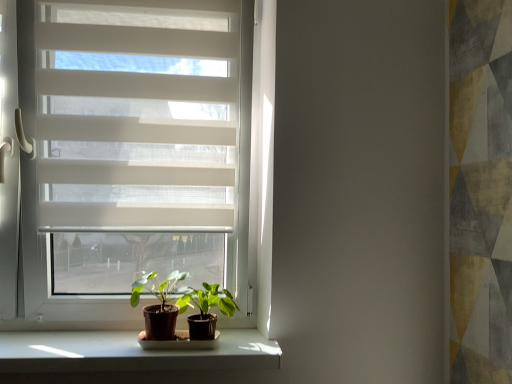
Question: From the image's perspective, is green matte plant at center, arranged as the second houseplant when viewed from the right, above green matte plant at center, the second houseplant positioned from the left?

Choices:
 (A) yes
 (B) no

Answer: (A)

Question: From the image's perspective, is green matte plant at center, arranged as the second houseplant when viewed from the right, under green matte plant at center, which appears as the first houseplant when viewed from the right?

Choices:
 (A) yes
 (B) no

Answer: (B)

Question: Does green matte plant at center, arranged as the second houseplant when viewed from the right, have a larger size compared to green matte plant at center, which appears as the first houseplant when viewed from the right?

Choices:
 (A) no
 (B) yes

Answer: (A)

Question: Considering the relative positions of green matte plant at center, arranged as the second houseplant when viewed from the right, and green matte plant at center, which appears as the first houseplant when viewed from the right, in the image provided, is green matte plant at center, arranged as the second houseplant when viewed from the right, to the left of green matte plant at center, which appears as the first houseplant when viewed from the right, from the viewer's perspective?

Choices:
 (A) no
 (B) yes

Answer: (B)

Question: Does green matte plant at center, arranged as the second houseplant when viewed from the right, come behind green matte plant at center, the second houseplant positioned from the left?

Choices:
 (A) yes
 (B) no

Answer: (A)

Question: Would you say green matte plant at center, which appears as the first houseplant when viewed from the right, is to the left or to the right of white translucent blinds at upper left in the picture?

Choices:
 (A) right
 (B) left

Answer: (A)

Question: From a real-world perspective, relative to white translucent blinds at upper left, is green matte plant at center, the second houseplant positioned from the left, vertically above or below?

Choices:
 (A) above
 (B) below

Answer: (B)

Question: In terms of size, does green matte plant at center, the second houseplant positioned from the left, appear bigger or smaller than white translucent blinds at upper left?

Choices:
 (A) big
 (B) small

Answer: (B)

Question: Considering the positions of green matte plant at center, which appears as the first houseplant when viewed from the right, and white translucent blinds at upper left in the image, is green matte plant at center, which appears as the first houseplant when viewed from the right, taller or shorter than white translucent blinds at upper left?

Choices:
 (A) short
 (B) tall

Answer: (A)

Question: From their relative heights in the image, would you say green matte plant at center, arranged as the second houseplant when viewed from the right, is taller or shorter than white translucent blinds at upper left?

Choices:
 (A) short
 (B) tall

Answer: (A)

Question: From the image's perspective, is green matte plant at center, which is the 1th houseplant from left to right, located above or below white translucent blinds at upper left?

Choices:
 (A) below
 (B) above

Answer: (A)

Question: Does point (148, 337) appear closer or farther from the camera than point (84, 51)?

Choices:
 (A) closer
 (B) farther

Answer: (A)

Question: Considering the positions of green matte plant at center, arranged as the second houseplant when viewed from the right, and white translucent blinds at upper left in the image, is green matte plant at center, arranged as the second houseplant when viewed from the right, bigger or smaller than white translucent blinds at upper left?

Choices:
 (A) small
 (B) big

Answer: (A)

Question: In terms of width, does white translucent blinds at upper left look wider or thinner when compared to green matte plant at center, which appears as the first houseplant when viewed from the right?

Choices:
 (A) wide
 (B) thin

Answer: (B)

Question: Which is correct: white translucent blinds at upper left is inside green matte plant at center, the second houseplant positioned from the left, or outside of it?

Choices:
 (A) outside
 (B) inside

Answer: (A)